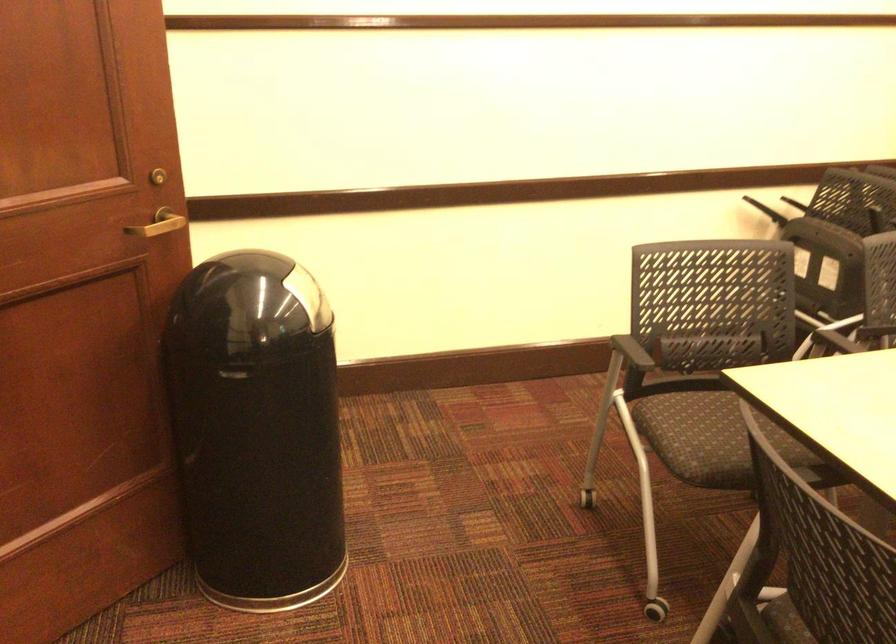
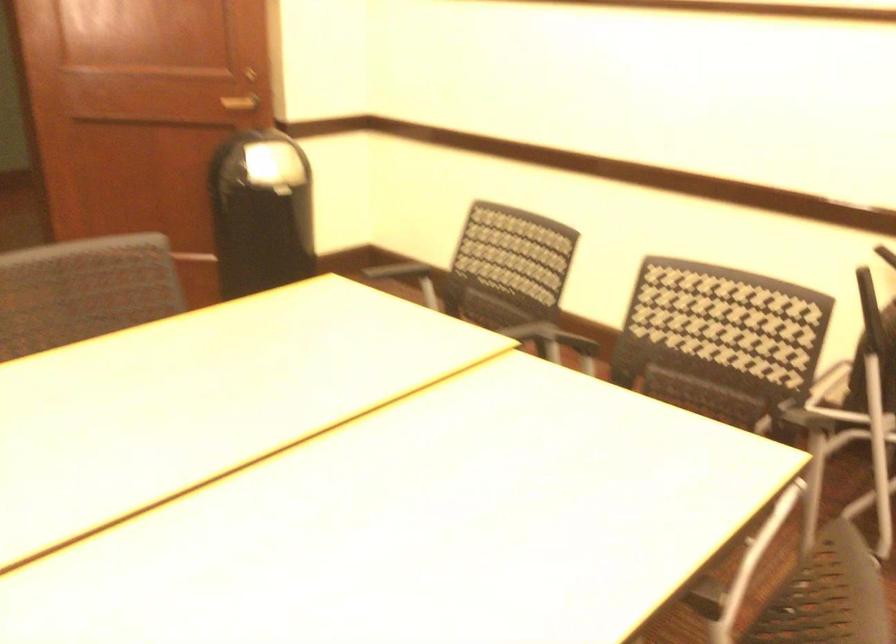
Question: I am providing you with two images of the same scene from different viewpoints. Please identify which objects are invisible in image2.

Choices:
 (A) chair sitting surface
 (B) black chair armrest
 (C) black fan dial
 (D) brown door handle

Answer: (A)